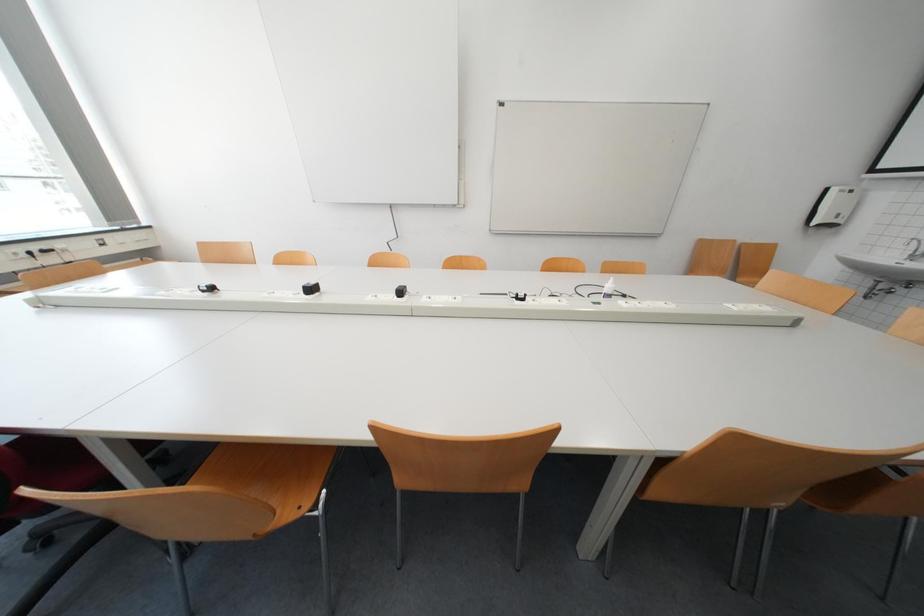
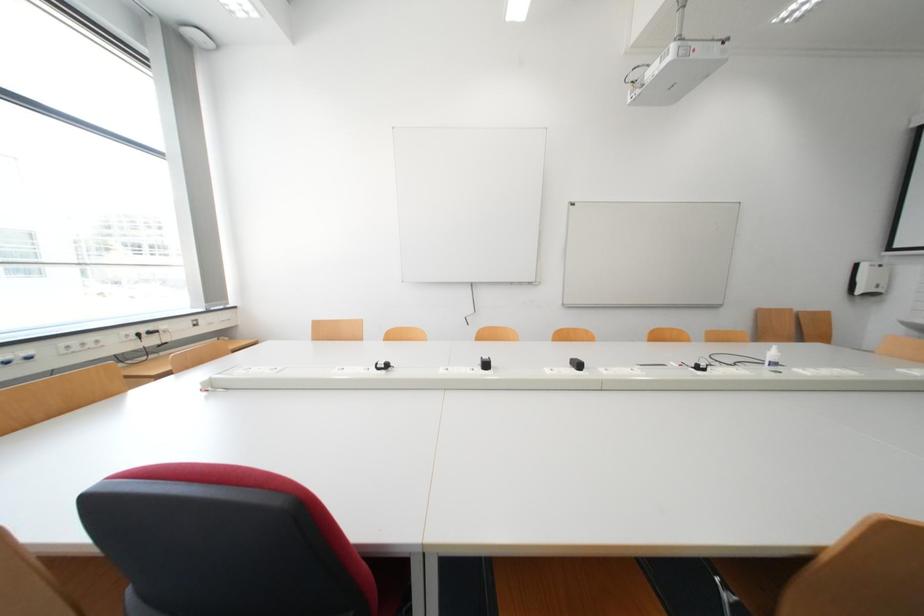
Question: The images are taken continuously from a first-person perspective. In which direction are you moving?

Choices:
 (A) Left
 (B) Right
 (C) Forward
 (D) Backward

Answer: (A)